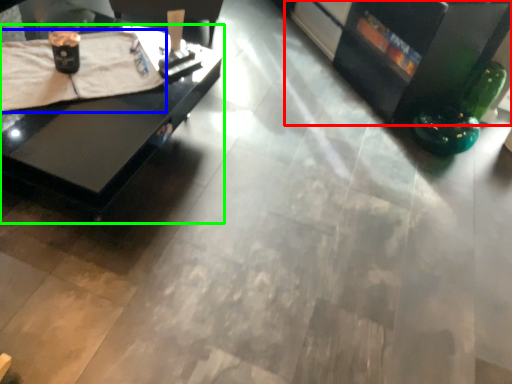
Question: Considering the real-world distances, which object is closest to entertainment center (highlighted by a red box)? blanket (highlighted by a blue box) or table (highlighted by a green box).

Choices:
 (A) blanket
 (B) table

Answer: (B)